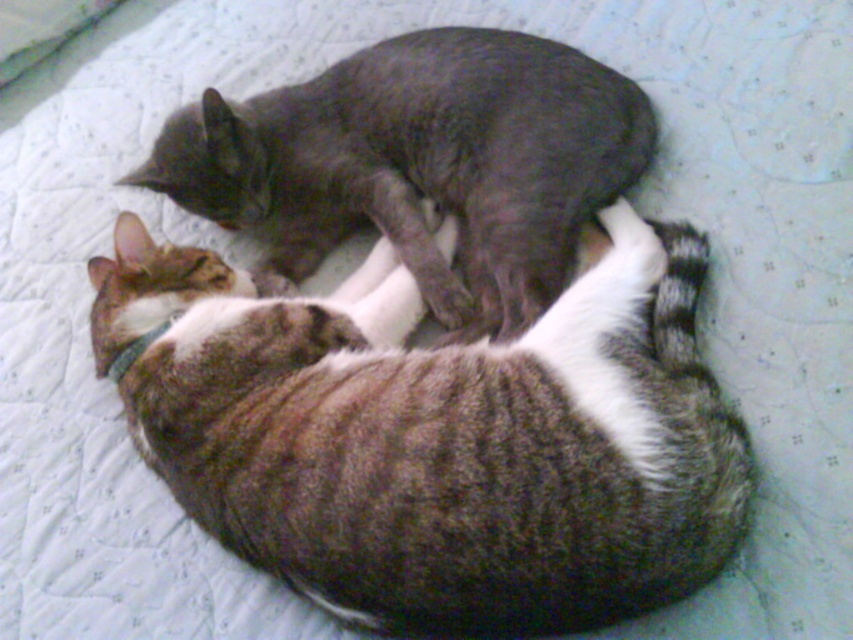
Is tabby fur cat at lower center behind gray smooth cat at upper center?

No.

Which is behind, point (656, 248) or point (503, 58)?

The point (503, 58) is behind.

At what (x,y) coordinates should I click in order to perform the action: click on tabby fur cat at lower center. Please return your answer as a coordinate pair (x, y). This screenshot has height=640, width=853. Looking at the image, I should click on (437, 435).